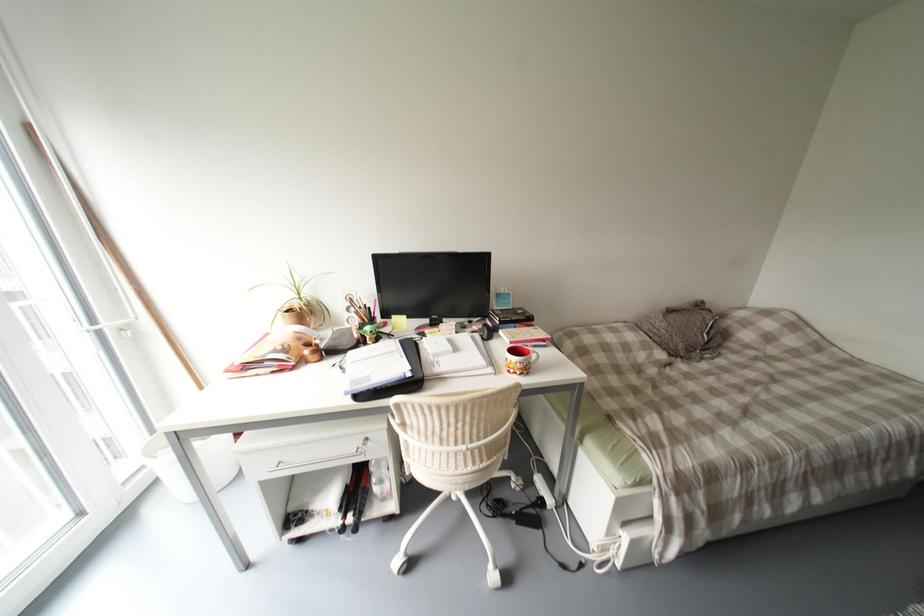
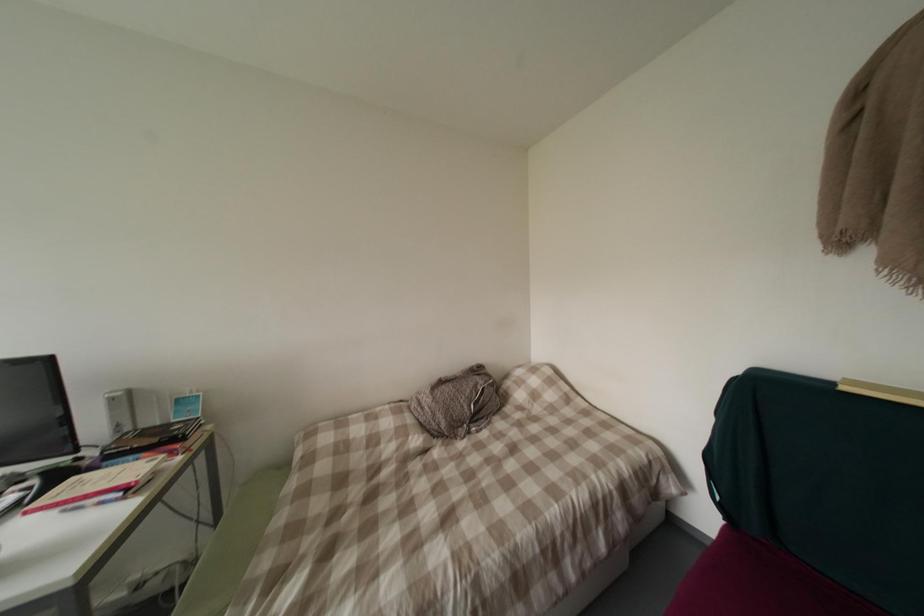
Question: In a continuous first-person perspective shot, in which direction is the camera moving?

Choices:
 (A) Left
 (B) Right
 (C) Forward
 (D) Backward

Answer: (B)